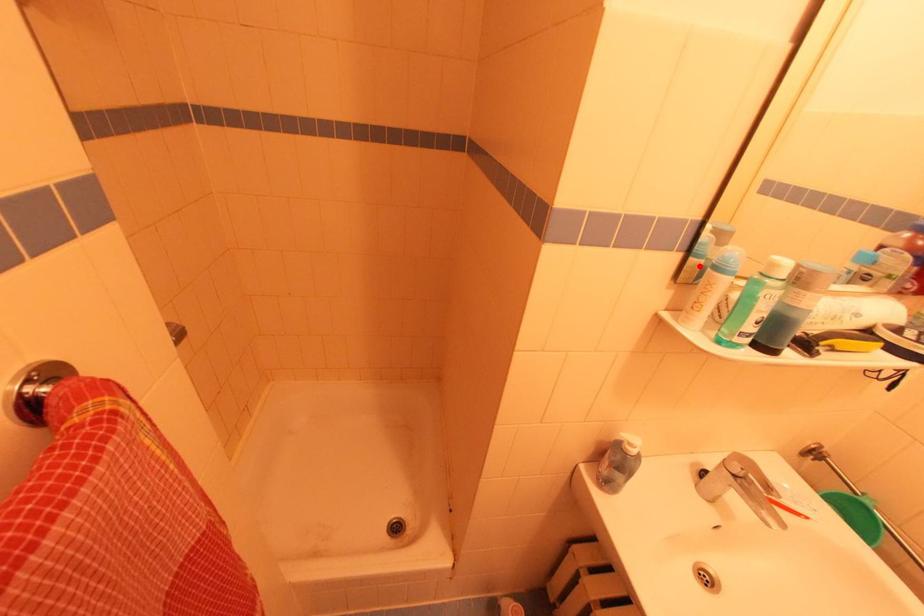
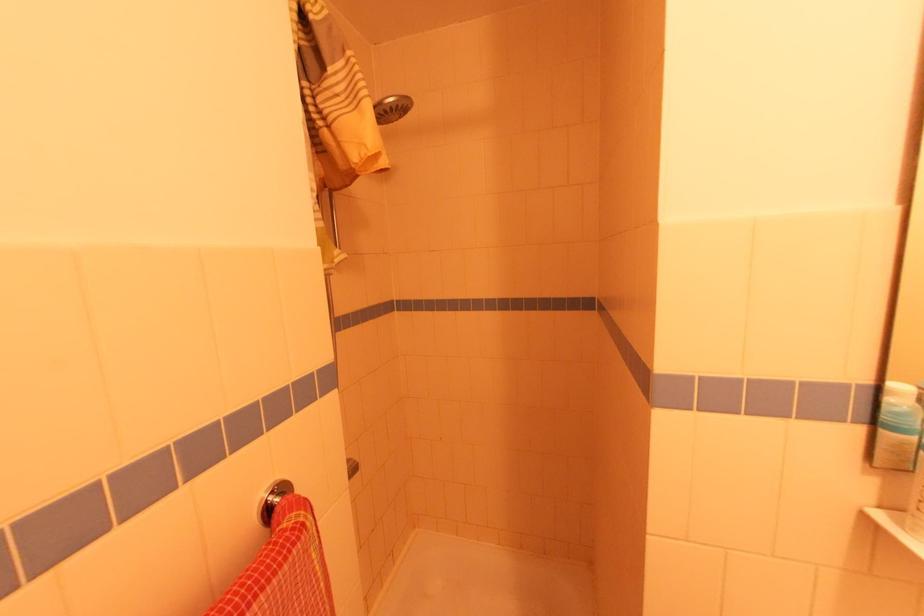
In the second image, find the point that corresponds to the highlighted location in the first image.

(906, 445)